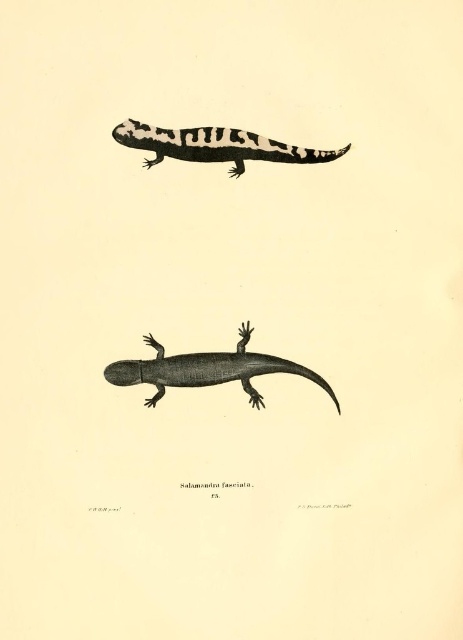
Is point (230, 372) more distant than point (321, 150)?

Yes, point (230, 372) is farther from viewer.

From the picture: Can you confirm if gray textured salamander at center is positioned below black and white striped salamander at upper center?

Yes, gray textured salamander at center is below black and white striped salamander at upper center.

Does point (144, 337) come behind point (196, 140)?

That is True.

Where is `gray textured salamander at center`? The image size is (463, 640). gray textured salamander at center is located at coordinates (206, 369).